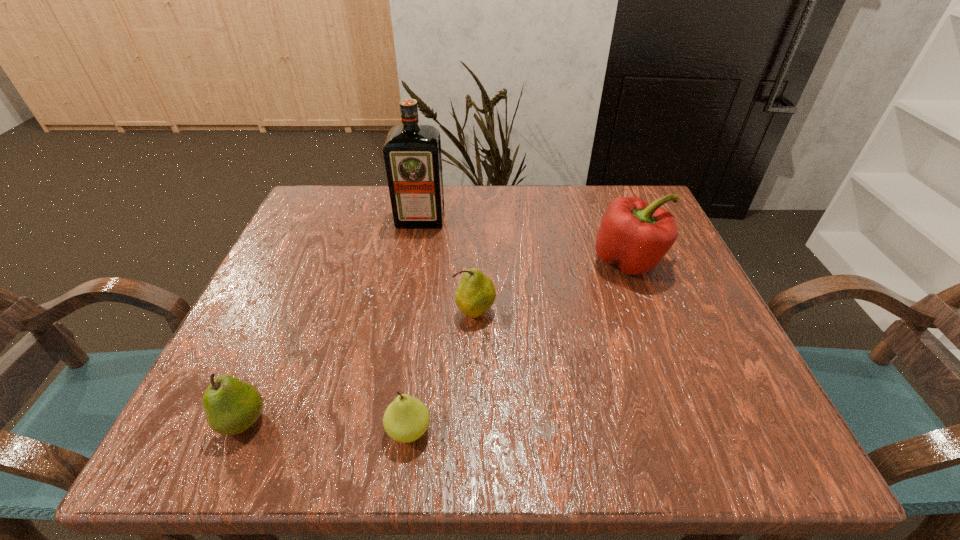
Where is `liquor`? The image size is (960, 540). liquor is located at coordinates (412, 153).

At what (x,y) coordinates should I click in order to perform the action: click on the farthest object. Please return your answer as a coordinate pair (x, y). The image size is (960, 540). Looking at the image, I should click on (412, 153).

This screenshot has width=960, height=540. In order to click on the second tallest object in this screenshot , I will do `click(634, 235)`.

Find the location of `the second farthest object`. the second farthest object is located at coordinates (634, 235).

Locate an element on the screen. the second object from right to left is located at coordinates click(476, 293).

Locate an element on the screen. The width and height of the screenshot is (960, 540). the third farthest object is located at coordinates (476, 293).

Locate an element on the screen. The height and width of the screenshot is (540, 960). the leftmost pear is located at coordinates (231, 406).

Find the location of a particular element. Image resolution: width=960 pixels, height=540 pixels. the second pear from right to left is located at coordinates (406, 419).

I want to click on free space located 0.140m on the front label of the tallest object, so click(x=412, y=268).

In order to click on vacant position located on the left of the fourth nearest object in this screenshot , I will do `click(540, 261)`.